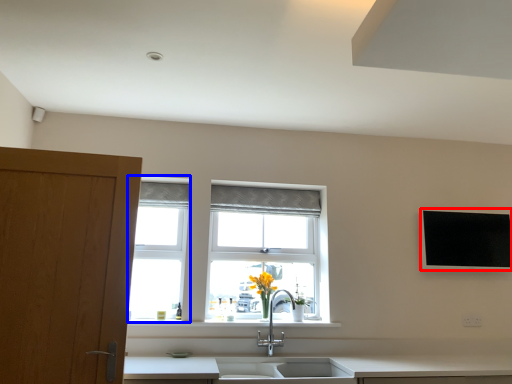
Question: Among these objects, which one is nearest to the camera, flat (highlighted by a red box) or window frame (highlighted by a blue box)?

Choices:
 (A) flat
 (B) window frame

Answer: (B)